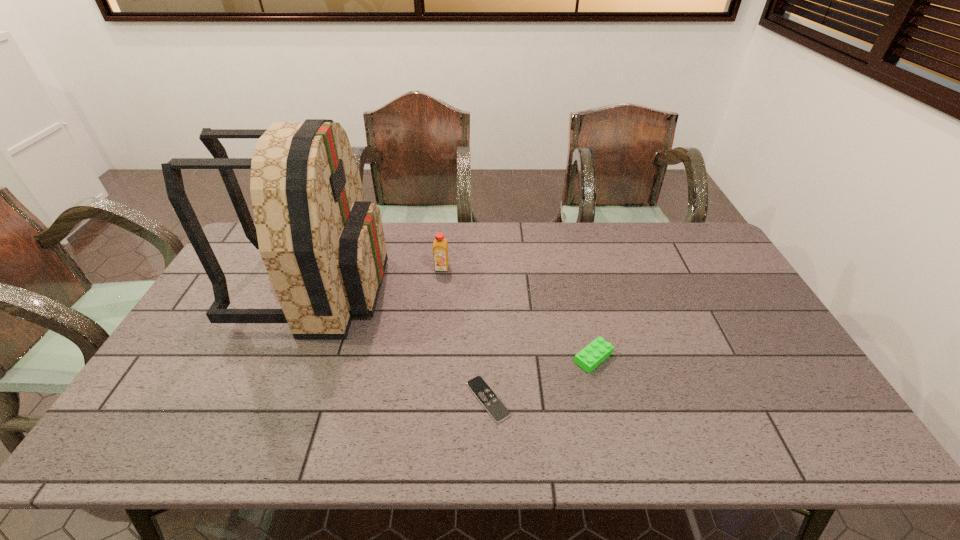
Where is `vacant area located on the left of the second shortest object`? This screenshot has width=960, height=540. vacant area located on the left of the second shortest object is located at coordinates (542, 357).

Find the location of a particular element. This screenshot has width=960, height=540. free space located on the back of the remote control is located at coordinates (486, 278).

Locate an element on the screen. The width and height of the screenshot is (960, 540). backpack that is at the far edge is located at coordinates (323, 245).

At what (x,y) coordinates should I click in order to perform the action: click on orange juice that is at the far edge. Please return your answer as a coordinate pair (x, y). This screenshot has width=960, height=540. Looking at the image, I should click on (440, 250).

Find the location of `object located in the near edge section of the desktop`. object located in the near edge section of the desktop is located at coordinates (478, 386).

Identify the location of object at the left edge. (323, 245).

You are a GUI agent. You are given a task and a screenshot of the screen. Output one action in this format:
    pyautogui.click(x=<x>, y=<y>)
    Task: Click on the object present at the far left corner
    
    Given the screenshot: What is the action you would take?
    pyautogui.click(x=323, y=245)

This screenshot has width=960, height=540. In the image, there is a desktop. Identify the location of vacant space at the far edge. (399, 255).

Identify the location of free location at the near edge. This screenshot has height=540, width=960. (576, 443).

In the image, there is a desktop. Identify the location of vacant space at the left edge. This screenshot has height=540, width=960. (213, 294).